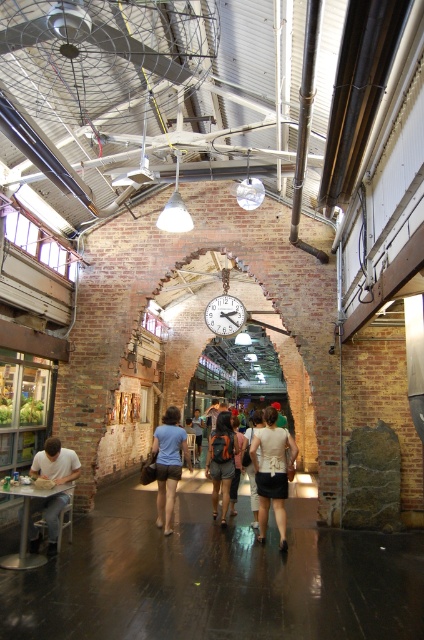
Question: Can you confirm if metallic/brass clock at center is wider than dark brown leather jacket at center?

Choices:
 (A) yes
 (B) no

Answer: (A)

Question: Which point is farther to the camera?

Choices:
 (A) (178, 442)
 (B) (242, 310)

Answer: (B)

Question: From the image, what is the correct spatial relationship of orange fabric backpack at center in relation to metallic/brass clock at center?

Choices:
 (A) left
 (B) right

Answer: (A)

Question: Considering the relative positions of matte white shirt at lower left and orange fabric backpack at center in the image provided, where is matte white shirt at lower left located with respect to orange fabric backpack at center?

Choices:
 (A) left
 (B) right

Answer: (A)

Question: Which point is farther to the camera?

Choices:
 (A) white matte shirt at center
 (B) blue denim shorts at center
 (C) metallic/brass clock at center

Answer: (C)

Question: Which object is positioned closest to the blue denim shorts at center?

Choices:
 (A) dark brown leather jacket at center
 (B) matte white shirt at lower left

Answer: (B)